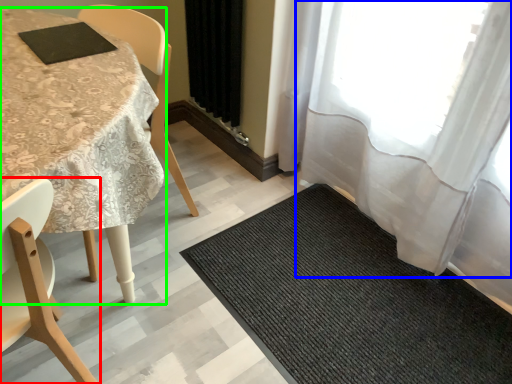
Question: Considering the real-world distances, which object is closest to chair (highlighted by a red box)? curtain (highlighted by a blue box) or table (highlighted by a green box).

Choices:
 (A) curtain
 (B) table

Answer: (B)